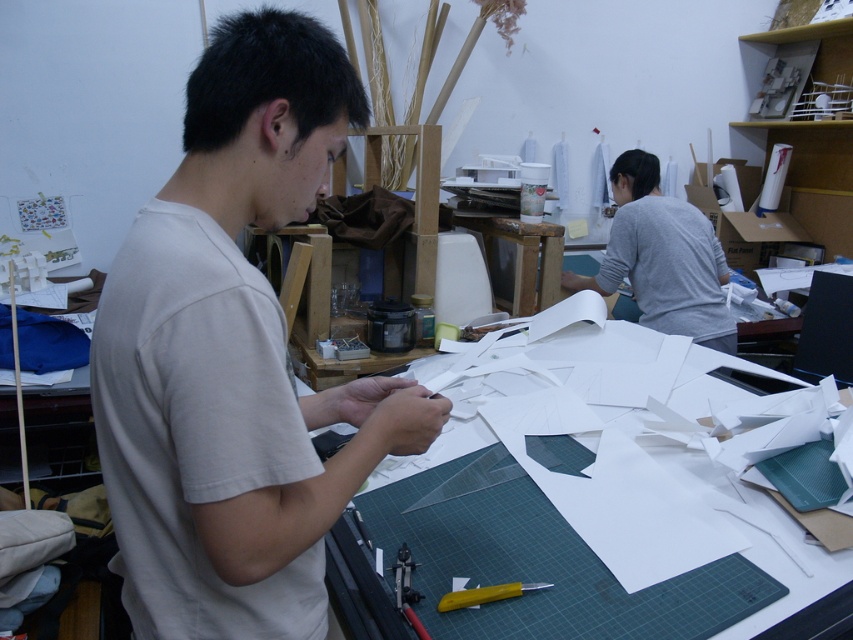
Question: Does white matte shirt at center come in front of white paper at center?

Choices:
 (A) yes
 (B) no

Answer: (A)

Question: Does white matte shirt at center appear on the left side of white paper at center?

Choices:
 (A) yes
 (B) no

Answer: (A)

Question: Does white matte shirt at center appear under white paper at center?

Choices:
 (A) yes
 (B) no

Answer: (B)